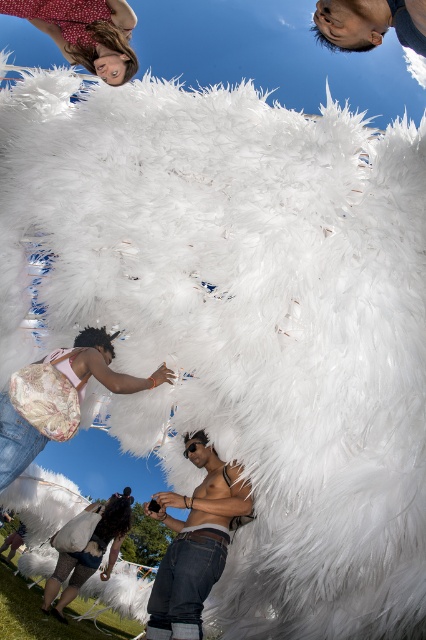
You are a photographer trying to capture the shiny metallic phone at center and the smooth skin head at upper right in the same frame. Which object should you focus on first to ensure both are in the shot?

The shiny metallic phone at center should be focused on first since it is positioned on the left side of the smooth skin head at upper right, allowing the photographer to frame both elements effectively.

You are an artist trying to sketch this scene. You want to ensure the proportions are accurate. Based on the objects in the scene, which one should you draw first to establish the scale, the smooth skin head at upper right or the matte white feathers at lower left?

The smooth skin head at upper right is smaller than the matte white feathers at lower left, so you should draw the matte white feathers at lower left first to establish the scale since it is the larger object.